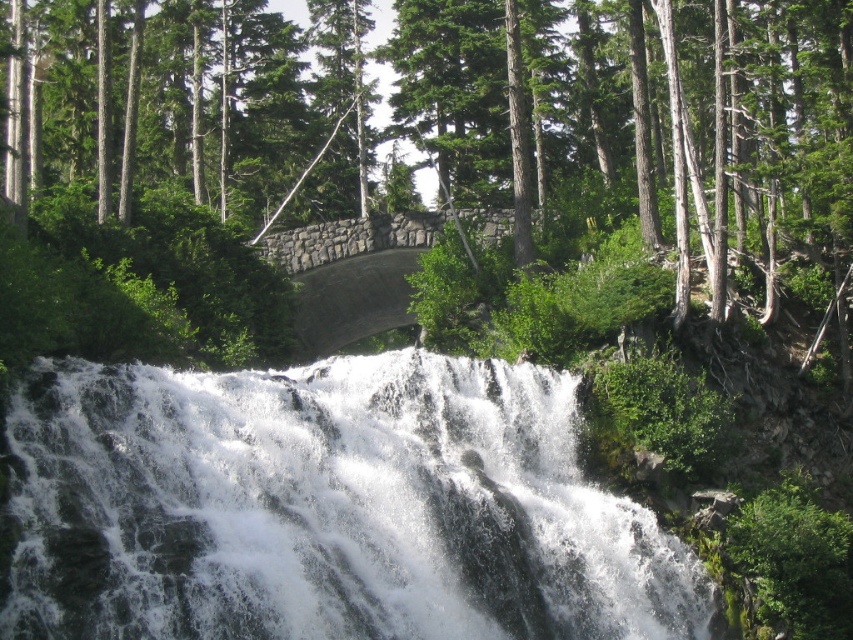
Question: Which of the following is the closest to the observer?

Choices:
 (A) (68, 480)
 (B) (756, 164)

Answer: (A)

Question: Is green leafy tree at center below white frothy water at center?

Choices:
 (A) no
 (B) yes

Answer: (A)

Question: Which point appears farthest from the camera in this image?

Choices:
 (A) (347, 596)
 (B) (778, 106)

Answer: (B)

Question: Among these objects, which one is nearest to the camera?

Choices:
 (A) white frothy water at center
 (B) green leafy tree at center

Answer: (A)

Question: Can you confirm if green leafy tree at center is bigger than white frothy water at center?

Choices:
 (A) yes
 (B) no

Answer: (A)

Question: Is green leafy tree at center further to the viewer compared to white frothy water at center?

Choices:
 (A) yes
 (B) no

Answer: (A)